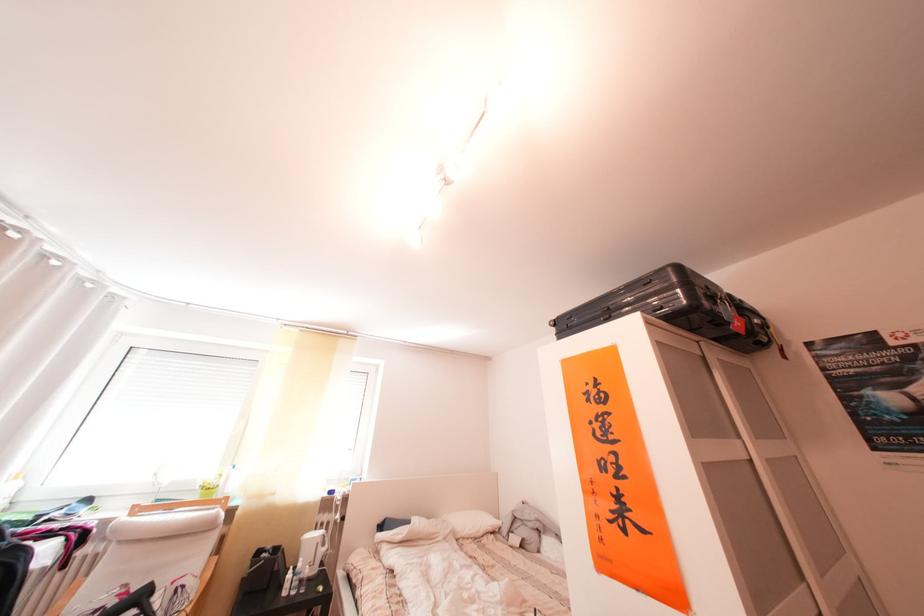
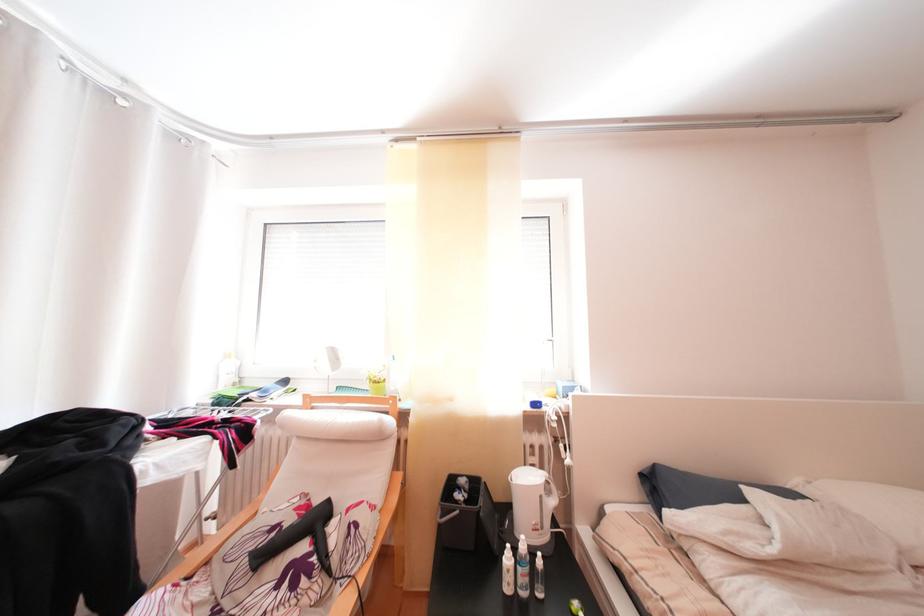
In the second image, find the point that corresponds to (x=312, y=570) in the first image.

(536, 553)